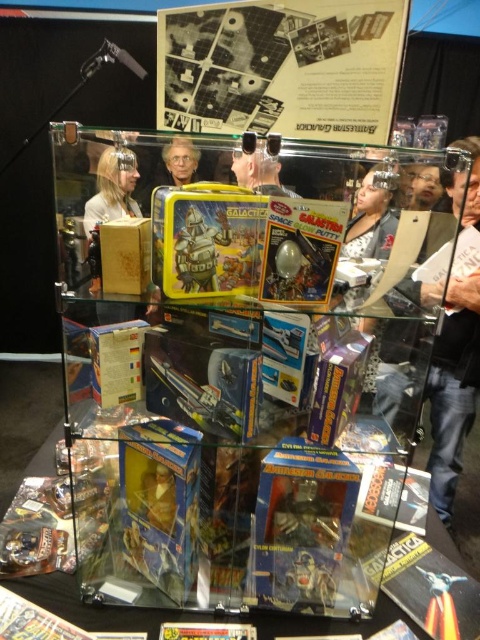
You are an organizer at the exhibition and need to place a new item between the metallic silver comic book at center and the metallic yellow lunchbox at center. Since you want the new item to fit snugly without overlapping, which object should you place it next to, the one with the smaller width?

The metallic yellow lunchbox at center has a smaller width than the metallic silver comic book at center, so place the new item next to the metallic yellow lunchbox at center.

You are a collector who wants to place a new toy in the display case. You have a toy that is 12 cm wide. The display case has a shelf that can only hold items narrower than 12 cm. Looking at the metallic orange toy at lower right and the yellow paper comic book at center, which item can you safely place on the shelf?

The metallic orange toy at lower right has a width less than the yellow paper comic book at center. Since the shelf can only hold items narrower than 12 cm, the metallic orange toy at lower right can be safely placed on the shelf if its width is under 12 cm. However, the exact width of the metallic orange toy at lower right isn

You are a collector trying to fit a matte black jacket at right and a yellow paper comic book at center into a storage box. The box can only accommodate items up to the size of the larger object. Which object determines the minimum required box size?

The matte black jacket at right determines the minimum required box size because its width is larger than the yellow paper comic book at center.